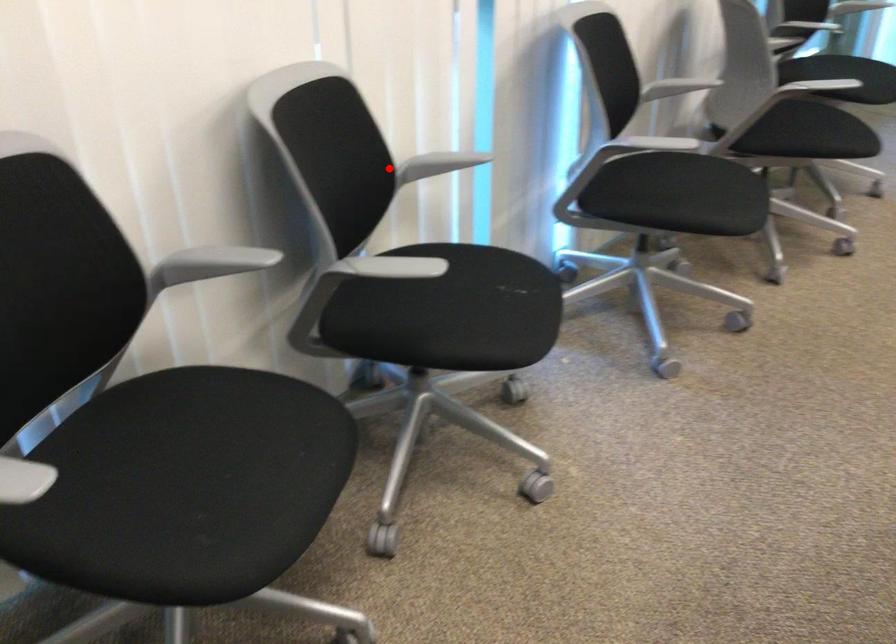
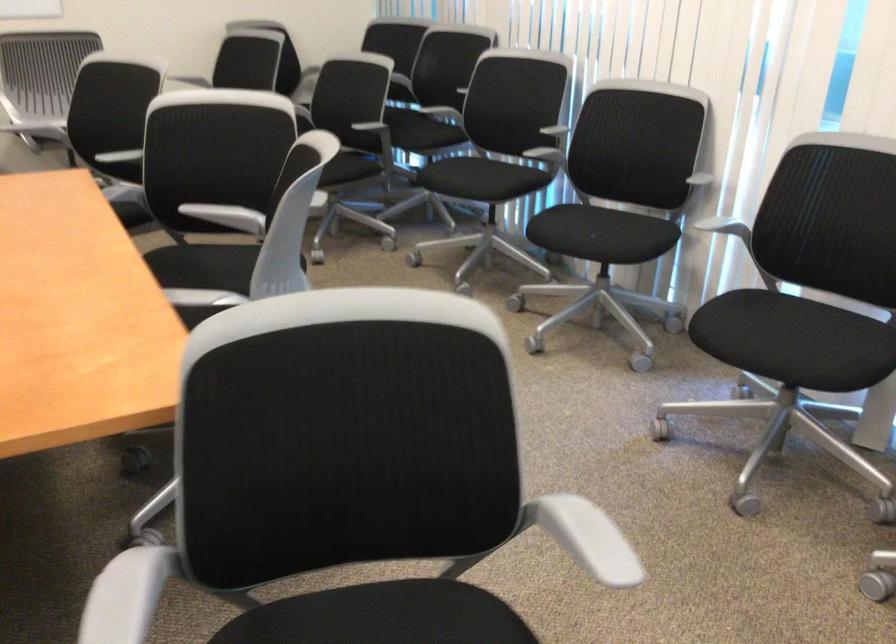
Question: I am providing you with two images of the same scene from different viewpoints. Image1 has a red point marked. In image2, the corresponding 3D location appears at what relative position? Reply with the corresponding letter.

Choices:
 (A) Closer
 (B) Farther

Answer: (B)